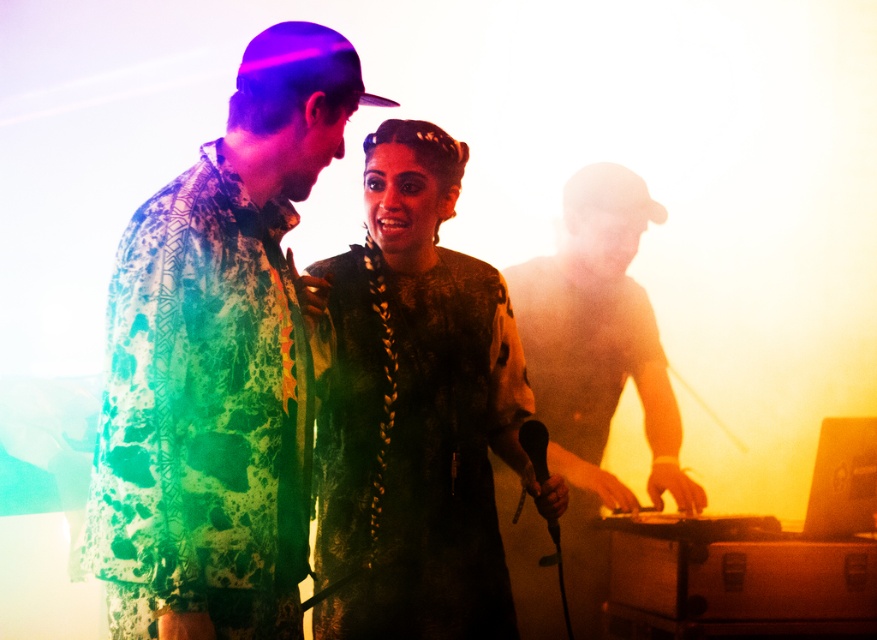
In order to click on velvet black dress at center in this screenshot , I will do `click(415, 412)`.

Who is shorter, velvet black dress at center or shiny metallic dj deck at right?

velvet black dress at center is shorter.

Is point (379, 465) closer to camera compared to point (625, 496)?

That is True.

Where is `velvet black dress at center`? The image size is (877, 640). velvet black dress at center is located at coordinates (415, 412).

Which is above, velvet black dress at center or black matte microphone at center?

velvet black dress at center is higher up.

Between velvet black dress at center and black matte microphone at center, which one appears on the left side from the viewer's perspective?

From the viewer's perspective, velvet black dress at center appears more on the left side.

Is point (421, 132) positioned behind point (553, 536)?

That is True.

The height and width of the screenshot is (640, 877). I want to click on velvet black dress at center, so click(x=415, y=412).

In the scene shown: Does printed fabric shirt at center have a greater width compared to velvet black dress at center?

In fact, printed fabric shirt at center might be narrower than velvet black dress at center.

Where is `printed fabric shirt at center`? printed fabric shirt at center is located at coordinates point(218,364).